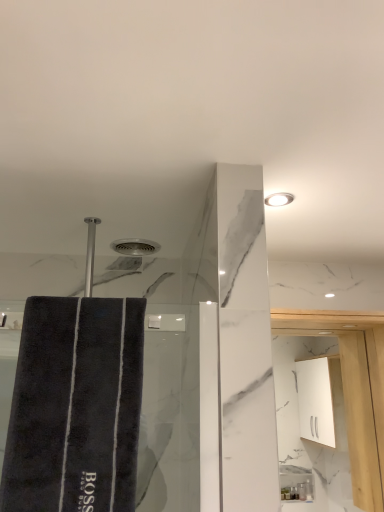
Question: From the image's perspective, relative to dark gray plush bath towel at left, is white glossy light fixture at upper right above or below?

Choices:
 (A) below
 (B) above

Answer: (B)

Question: In terms of height, does white glossy light fixture at upper right look taller or shorter compared to dark gray plush bath towel at left?

Choices:
 (A) tall
 (B) short

Answer: (B)

Question: Based on their relative distances, which object is nearer to the white glossy light fixture at upper right?

Choices:
 (A) white glossy cabinet at upper right
 (B) dark gray plush bath towel at left

Answer: (B)

Question: Estimate the real-world distances between objects in this image. Which object is closer to the white glossy light fixture at upper right?

Choices:
 (A) dark gray plush bath towel at left
 (B) white glossy cabinet at upper right

Answer: (A)